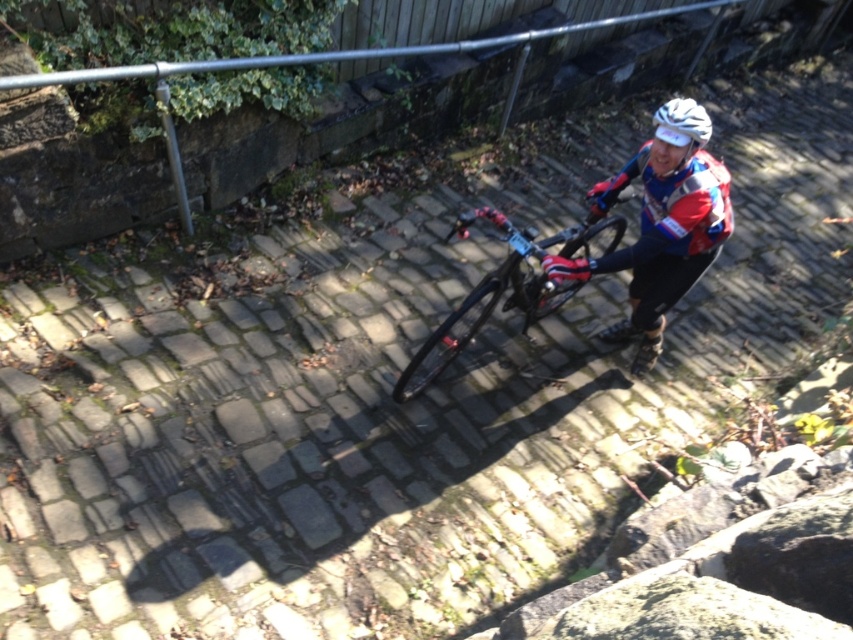
Question: Which of the following is the farthest from the observer?

Choices:
 (A) shiny black frame at center
 (B) red and white jersey at center
 (C) white matte bicycle helmet at upper center
 (D) shiny blue jersey at center

Answer: (A)

Question: Does shiny blue jersey at center have a lesser width compared to shiny black frame at center?

Choices:
 (A) no
 (B) yes

Answer: (A)

Question: Which point is farther to the camera?

Choices:
 (A) shiny blue jersey at center
 (B) shiny black frame at center
 (C) white matte bicycle helmet at upper center

Answer: (B)

Question: Based on their relative distances, which object is farther from the white matte bicycle helmet at upper center?

Choices:
 (A) red and white jersey at center
 (B) shiny black frame at center
 (C) shiny blue jersey at center

Answer: (B)

Question: Does shiny blue jersey at center have a lesser width compared to white matte bicycle helmet at upper center?

Choices:
 (A) no
 (B) yes

Answer: (A)

Question: Does red and white jersey at center have a larger size compared to white matte bicycle helmet at upper center?

Choices:
 (A) yes
 (B) no

Answer: (A)